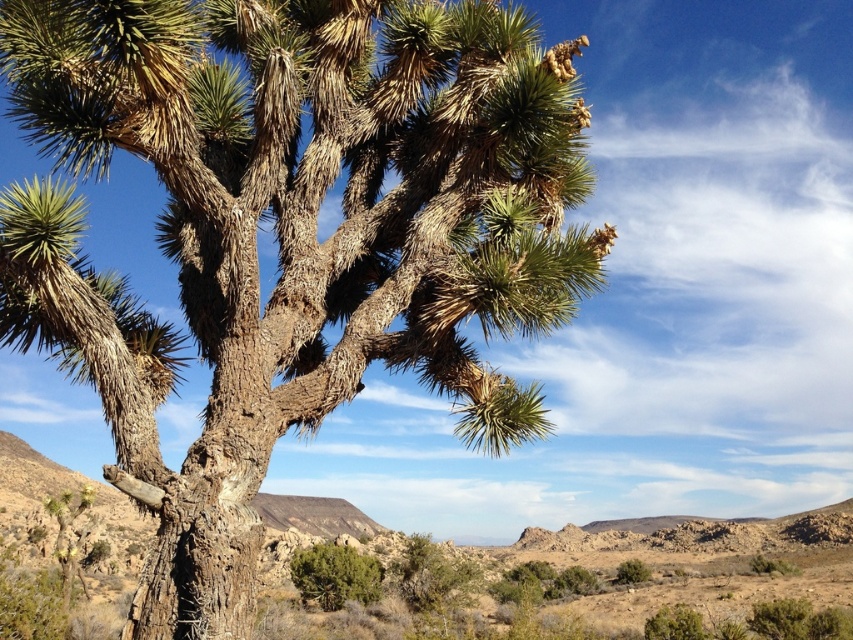
Does green leafy bush at lower center lie in front of green leafy bush at lower right?

Yes, green leafy bush at lower center is closer to the viewer.

Is point (303, 593) positioned in front of point (637, 561)?

Yes, point (303, 593) is closer to viewer.

Find the location of `green leafy bush at lower center`. green leafy bush at lower center is located at coordinates (335, 576).

This screenshot has width=853, height=640. What do you see at coordinates (697, 572) in the screenshot? I see `brown rough desert at center` at bounding box center [697, 572].

Between brown rough desert at center and green leafy bush at lower right, which one has less height?

green leafy bush at lower right

Identify the location of brown rough desert at center. (697, 572).

Find the location of a particular element. The image size is (853, 640). brown rough desert at center is located at coordinates click(697, 572).

Is brown rough desert at center positioned in front of green leafy bush at lower center?

Yes, brown rough desert at center is closer to the viewer.

Who is positioned more to the right, brown rough desert at center or green leafy bush at lower center?

Positioned to the right is brown rough desert at center.

Who is more forward, (53, 484) or (297, 554)?

Point (297, 554) is more forward.

At what (x,y) coordinates should I click in order to perform the action: click on brown rough desert at center. Please return your answer as a coordinate pair (x, y). Looking at the image, I should click on (697, 572).